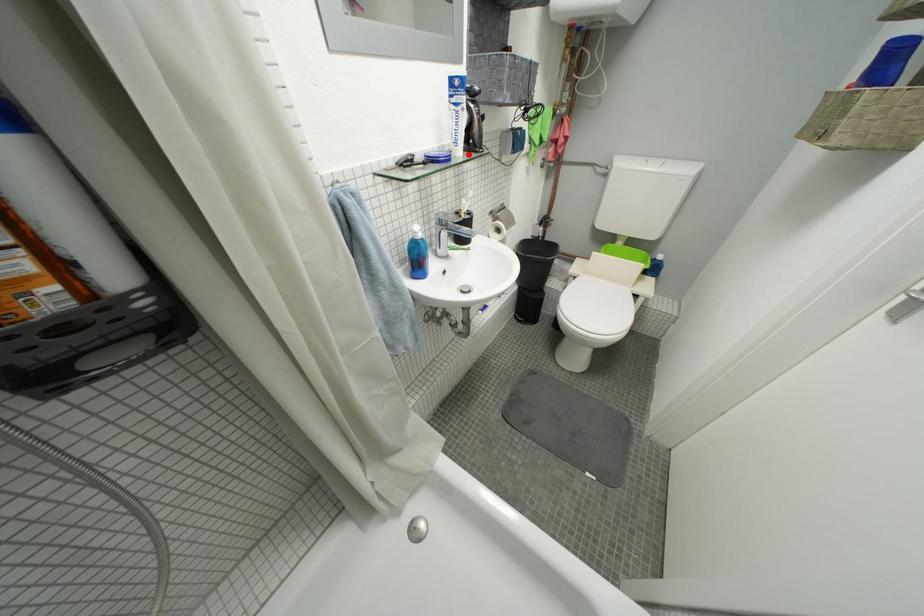
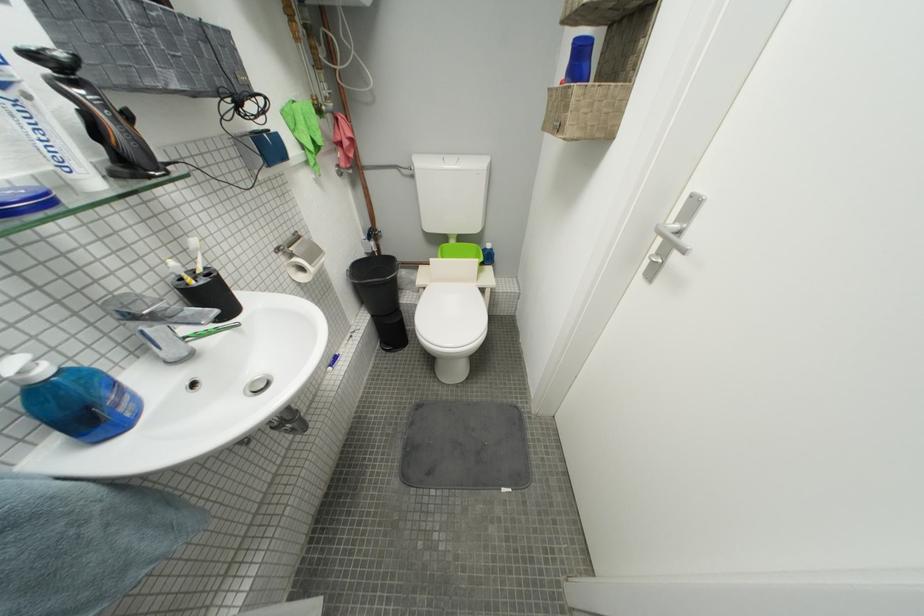
Question: A red point is marked in image1. In image2, is the corresponding 3D point closer to the camera or farther? Reply with the corresponding letter.

Choices:
 (A) The corresponding 3D point is closer.
 (B) The corresponding 3D point is farther.

Answer: (B)